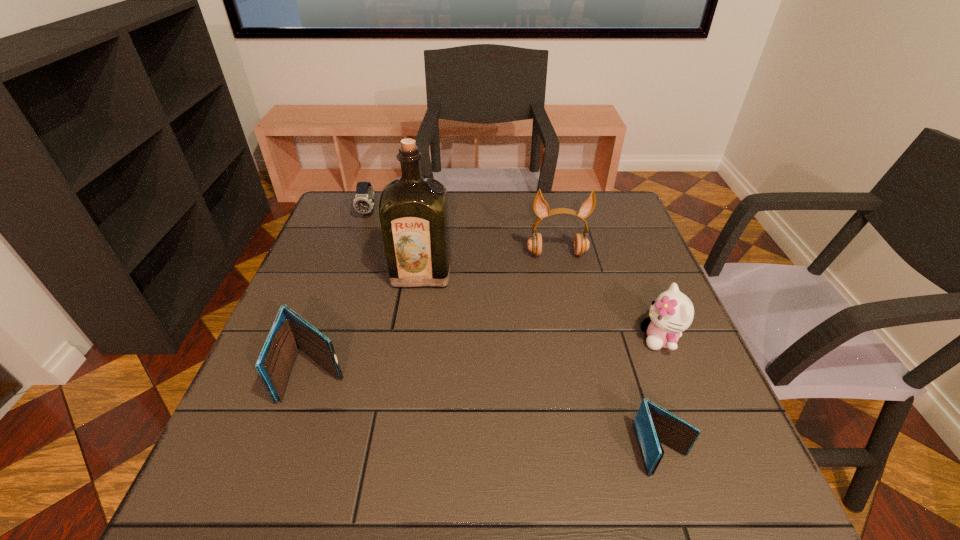
This screenshot has width=960, height=540. Identify the location of the taller wallet. (290, 332).

This screenshot has height=540, width=960. What are the coordinates of `the left wallet` in the screenshot? It's located at (290, 332).

This screenshot has width=960, height=540. I want to click on the shorter wallet, so click(x=653, y=424).

This screenshot has width=960, height=540. In order to click on the nearer wallet in this screenshot , I will do `click(653, 424)`.

The height and width of the screenshot is (540, 960). Identify the location of the farthest object. (363, 202).

The image size is (960, 540). What are the coordinates of `the fifth tallest object` in the screenshot? It's located at (363, 202).

What are the coordinates of `the second tallest object` in the screenshot? It's located at (581, 244).

The width and height of the screenshot is (960, 540). Find the location of `kitten`. kitten is located at coordinates (671, 313).

The image size is (960, 540). I want to click on the third object from left to right, so click(413, 209).

Where is `the tallest object`? the tallest object is located at coordinates (413, 209).